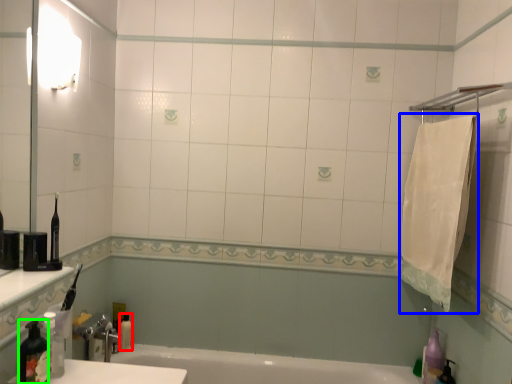
Question: Which object is positioned closest to toiletry (highlighted by a red box)? Select from bath towel (highlighted by a blue box) and bottle (highlighted by a green box).

Choices:
 (A) bath towel
 (B) bottle

Answer: (B)